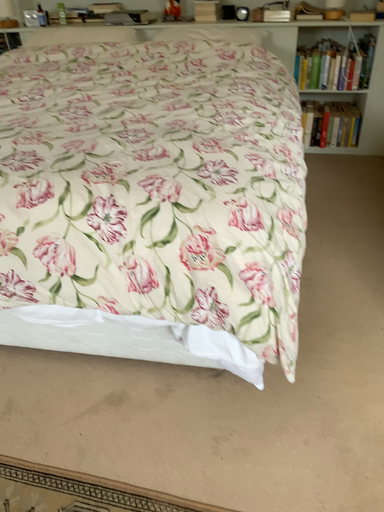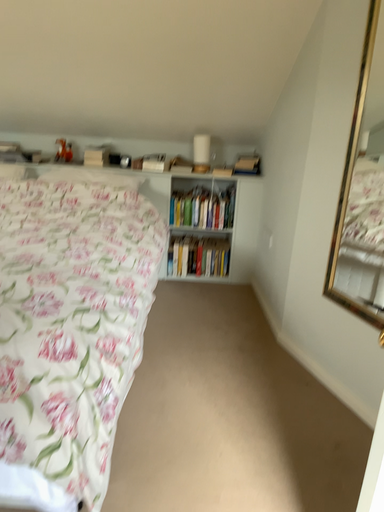
Question: How did the camera likely rotate when shooting the video?

Choices:
 (A) rotated right
 (B) rotated left

Answer: (A)